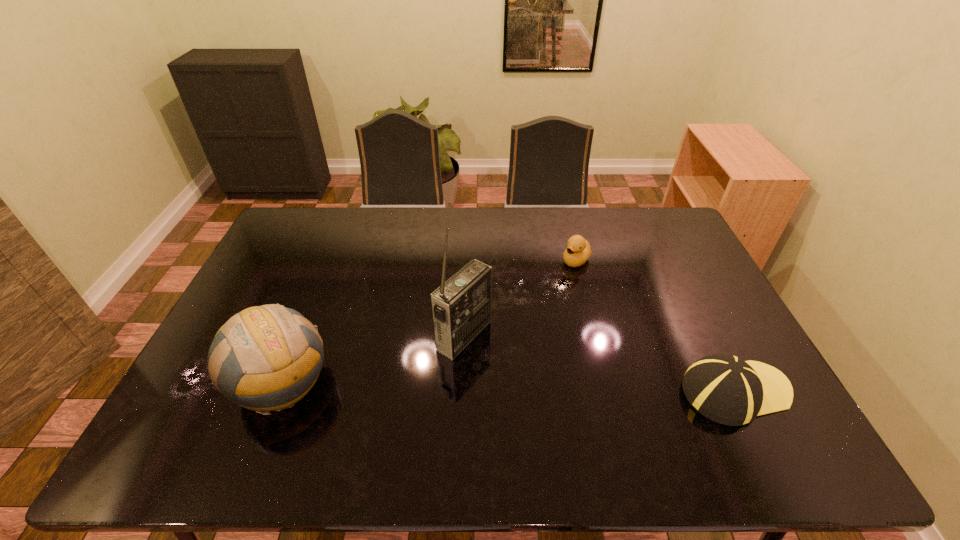
The height and width of the screenshot is (540, 960). Find the location of `the leftmost object`. the leftmost object is located at coordinates (x=266, y=358).

Where is `the second tallest object`? The width and height of the screenshot is (960, 540). the second tallest object is located at coordinates click(266, 358).

Where is `the rightmost object`? This screenshot has height=540, width=960. the rightmost object is located at coordinates (724, 388).

Where is `duckling`? This screenshot has height=540, width=960. duckling is located at coordinates (578, 251).

Identify the location of the farthest object. The image size is (960, 540). (578, 251).

The width and height of the screenshot is (960, 540). In order to click on the second object from left to right in this screenshot , I will do `click(461, 307)`.

Locate an element on the screen. radio receiver is located at coordinates [461, 307].

You are a GUI agent. You are given a task and a screenshot of the screen. Output one action in this format:
    pyautogui.click(x=<x>, y=<y>)
    Task: Click on the blank area located 0.210m on the back of the leftmost object
    Image resolution: width=960 pixels, height=540 pixels.
    Given the screenshot: What is the action you would take?
    pyautogui.click(x=318, y=293)

You are a GUI agent. You are given a task and a screenshot of the screen. Output one action in this format:
    pyautogui.click(x=<x>, y=<y>)
    Task: Click on the vacant space situated 0.270m facing forward on the farthest object
    The image size is (960, 540).
    Given the screenshot: What is the action you would take?
    pyautogui.click(x=522, y=314)

Identify the location of vacant space situated 0.390m facing forward on the farthest object. (497, 338).